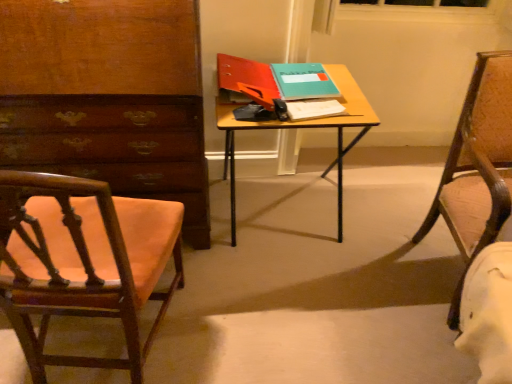
The width and height of the screenshot is (512, 384). I want to click on vacant space in front of teal matte book at center, acting as the 1th book starting from the right, so click(x=316, y=112).